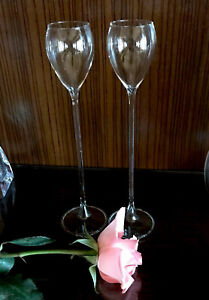
Where is `wooden panel`? The image size is (209, 300). wooden panel is located at coordinates (43, 141).